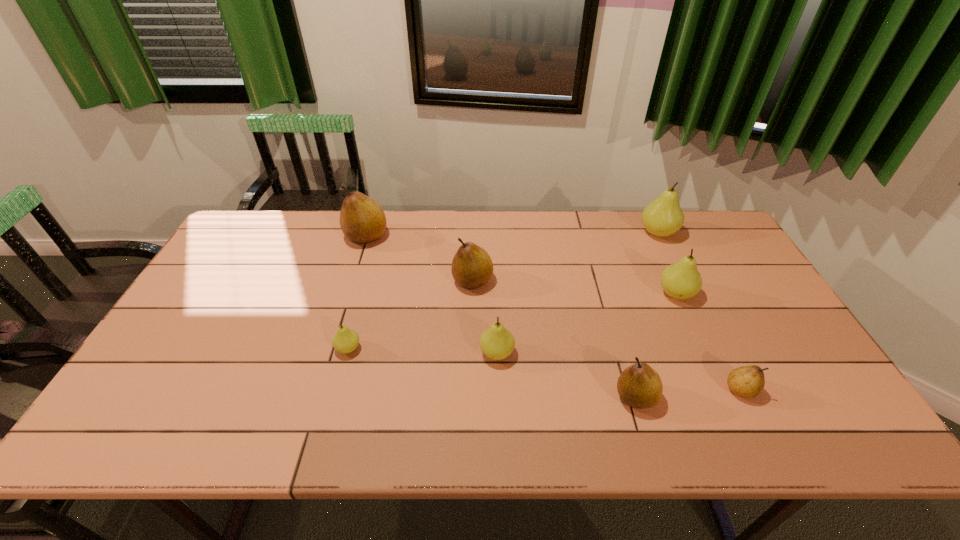
I want to click on object that is at the right edge, so (x=662, y=217).

Locate an element on the screen. object that is at the far right corner is located at coordinates (662, 217).

At what (x,y) coordinates should I click in order to perform the action: click on free space at the far edge. Please return your answer as a coordinate pair (x, y). Image resolution: width=960 pixels, height=540 pixels. Looking at the image, I should click on (444, 247).

The height and width of the screenshot is (540, 960). What are the coordinates of `free region at the left edge of the desktop` in the screenshot? It's located at (174, 328).

I want to click on vacant space at the far left corner, so click(x=276, y=222).

You are a GUI agent. You are given a task and a screenshot of the screen. Output one action in this format:
    pyautogui.click(x=<x>, y=<y>)
    Task: Click on the free location at the far right corner
    The width and height of the screenshot is (960, 540).
    Given the screenshot: What is the action you would take?
    pyautogui.click(x=691, y=236)

Identify the location of free spot between the farthest green pear and the smallest green pear. Image resolution: width=960 pixels, height=540 pixels. (503, 291).

Find the location of `vacant point located between the rightmost brown pear and the second biggest brown pear`. vacant point located between the rightmost brown pear and the second biggest brown pear is located at coordinates (607, 335).

Image resolution: width=960 pixels, height=540 pixels. In order to click on blank region between the second biggest green pear and the biggest brown pear in this screenshot , I will do `click(521, 265)`.

This screenshot has height=540, width=960. In order to click on free space that is in between the smallest green pear and the rightmost brown pear in this screenshot , I will do `click(544, 369)`.